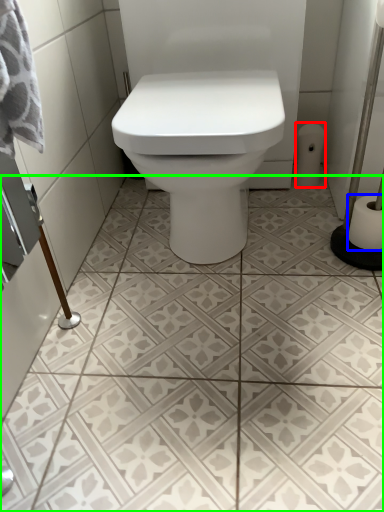
Question: Based on their relative distances, which object is nearer to toilet paper (highlighted by a red box)? Choose from toilet paper (highlighted by a blue box) and ceramic tile (highlighted by a green box).

Choices:
 (A) toilet paper
 (B) ceramic tile

Answer: (A)